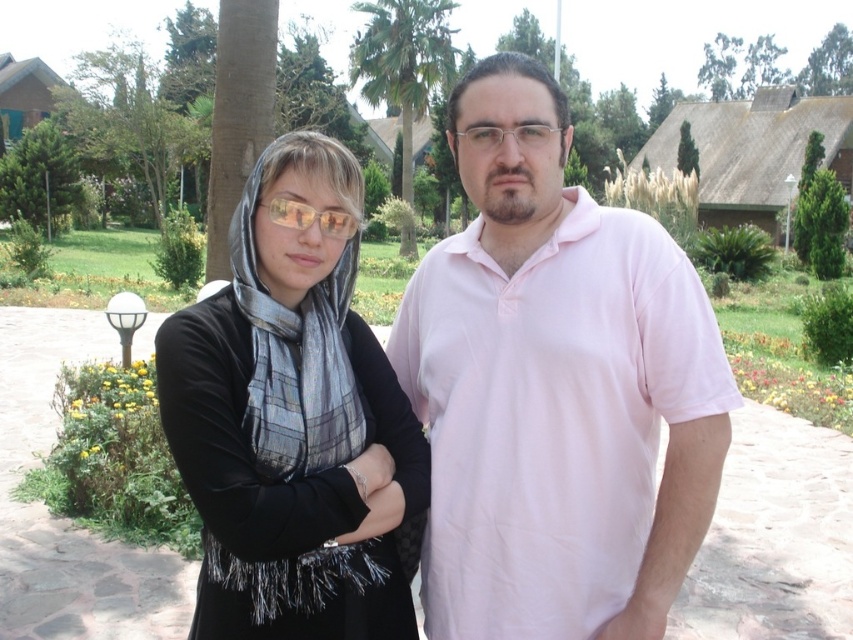
Looking at this image, you are a photographer trying to capture both the green leafy palm tree at center and the matte yellow lenses at center in a single frame. Based on their sizes, will the palm tree likely occupy more space in the photo than the matte yellow lenses?

The green leafy palm tree at center might be wider than matte yellow lenses at center, so it is likely that the palm tree will occupy more space in the photo than the matte yellow lenses.

Based on the photo, you are organizing a clothing display and need to place the pink cotton shirt at center and the matte black dress at center side by side. Which clothing item requires more horizontal space due to its width?

The pink cotton shirt at center requires more horizontal space because its width is larger than the matte black dress at center.

You are organizing a clothing donation drive and need to determine which of the two garments, the pink cotton shirt at center or the matte black dress at center, takes up more space in a donation box. Based on the image, which one should you consider taking first to ensure efficient packing?

The pink cotton shirt at center is bigger than the matte black dress at center, so you should take the pink cotton shirt at center first as it occupies more space and needs to be packed first for efficient use of space.